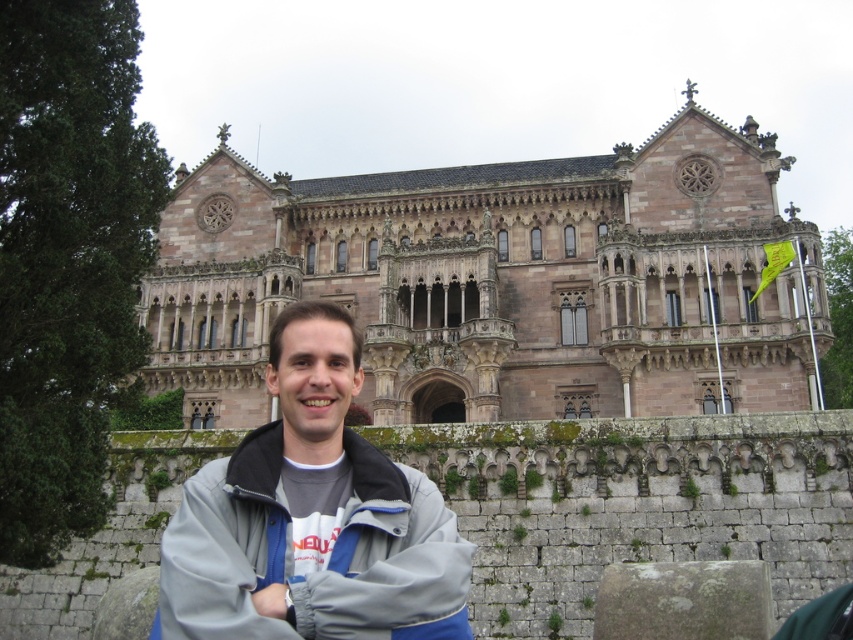
Does point (672, 333) come in front of point (321, 513)?

No, (672, 333) is behind (321, 513).

Is point (397, 307) farther from viewer compared to point (289, 419)?

Yes, point (397, 307) is farther from viewer.

Is point (578, 257) less distant than point (276, 579)?

No, (578, 257) is behind (276, 579).

You are a GUI agent. You are given a task and a screenshot of the screen. Output one action in this format:
    pyautogui.click(x=<x>, y=<y>)
    Task: Click on the brown stone building at center
    
    Given the screenshot: What is the action you would take?
    pyautogui.click(x=500, y=282)

Does gray fleece jacket at center lie behind gray fleece jacket at lower center?

No, gray fleece jacket at center is closer to the viewer.

Which is in front, point (155, 624) or point (195, 614)?

Point (195, 614) is more forward.

You are a GUI agent. You are given a task and a screenshot of the screen. Output one action in this format:
    pyautogui.click(x=<x>, y=<y>)
    Task: Click on the gray fleece jacket at center
    The height and width of the screenshot is (640, 853).
    Given the screenshot: What is the action you would take?
    (311, 516)

Can you confirm if brown stone building at center is taller than gray fleece jacket at lower center?

Indeed, brown stone building at center has a greater height compared to gray fleece jacket at lower center.

The height and width of the screenshot is (640, 853). What do you see at coordinates (500, 282) in the screenshot? I see `brown stone building at center` at bounding box center [500, 282].

The image size is (853, 640). In order to click on brown stone building at center in this screenshot , I will do `click(500, 282)`.